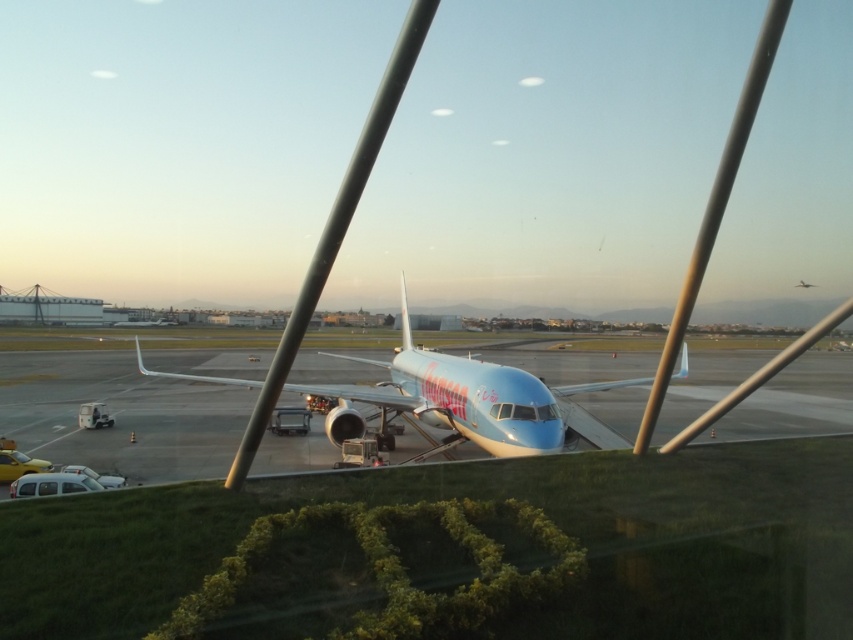
You are standing at the airport terminal and looking out through the window. There is a light blue metallic airplane at center. Based on its position coordinates, can you determine if the airplane is closer to the bottom or the top of the window?

The light blue metallic airplane at center is positioned at coordinates point (468,401). Since the y coordinate is 0.550, which is closer to 0.5 than 0 or 1, the airplane is near the center vertically. Therefore, it is neither closer to the bottom nor the top of the window.

You are a maintenance technician with a 10 meter long ladder. You need to reach the light blue metallic airplane at center from your current position. Can you safely use the ladder to reach the airplane without moving it?

→ The distance between the light blue metallic airplane at center and the camera is 9.31 meters. Since the ladder is 10 meters long, it is long enough to reach the airplane. Therefore, you can safely use the ladder to reach the airplane without moving it.

You are an airport maintenance worker who needs to determine which airplane, the light blue metallic airplane at center or the metallic silver airplane at center, requires a taller ladder for servicing the top of the fuselage. Which one do you choose?

The light blue metallic airplane at center is taller than the metallic silver airplane at center, so you should choose the taller ladder for the light blue metallic airplane at center.